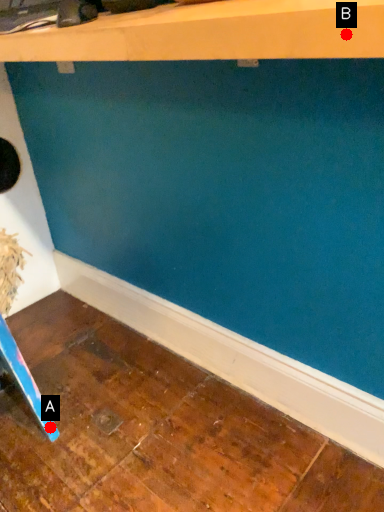
Question: Two points are circled on the image, labeled by A and B beside each circle. Which of the following is the farthest from the observer?

Choices:
 (A) A is further
 (B) B is further

Answer: (A)